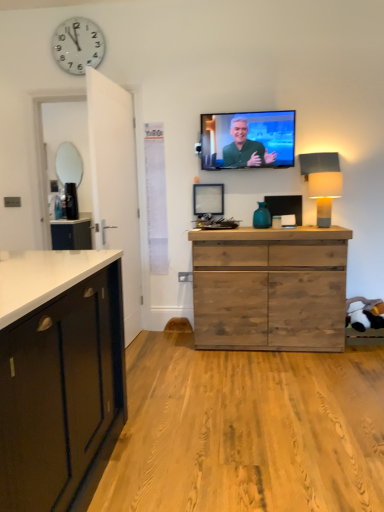
Question: In terms of height, does matte silver mirror at left look taller or shorter compared to matte green screen at upper center?

Choices:
 (A) short
 (B) tall

Answer: (B)

Question: Looking at their shapes, would you say matte silver mirror at left is wider or thinner than matte green screen at upper center?

Choices:
 (A) thin
 (B) wide

Answer: (A)

Question: Estimate the real-world distances between objects in this image. Which object is farther from the wooden picture frame at center?

Choices:
 (A) blue glass vase at center
 (B) black glossy coffee maker at left
 (C) matte gray lampshade at right
 (D) white plastic clock at upper left
 (E) matte silver mirror at left

Answer: (D)

Question: Estimate the real-world distances between objects in this image. Which object is closer to the matte gray lampshade at right?

Choices:
 (A) matte green screen at upper center
 (B) matte silver mirror at left
 (C) white plastic clock at upper left
 (D) rustic wood chest of drawers at center
 (E) wooden picture frame at center

Answer: (A)